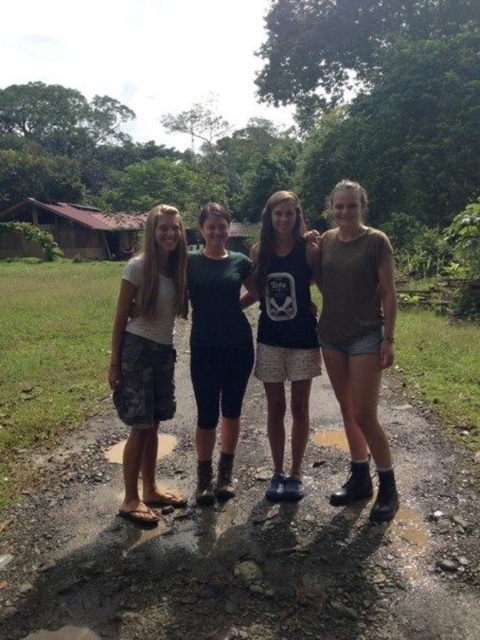
Question: Among these points, which one is nearest to the camera?

Choices:
 (A) (384, 353)
 (B) (152, 410)
 (C) (333, 557)

Answer: (C)

Question: Can you confirm if brown dirt track at center is positioned to the right of brown matte puddle at lower left?

Choices:
 (A) yes
 (B) no

Answer: (A)

Question: Which of the following is the closest to the observer?

Choices:
 (A) (245, 300)
 (B) (85, 221)
 (C) (360, 388)
 (D) (264, 323)

Answer: (C)

Question: Is the position of brown denim shorts at lower right less distant than that of green knit dress at center?

Choices:
 (A) no
 (B) yes

Answer: (B)

Question: Which point is farther from the camera taking this photo?

Choices:
 (A) (207, 502)
 (B) (385, 632)
 (C) (156, 452)

Answer: (C)

Question: Can you confirm if brown dirt track at center is wider than brown denim shorts at lower right?

Choices:
 (A) yes
 (B) no

Answer: (B)